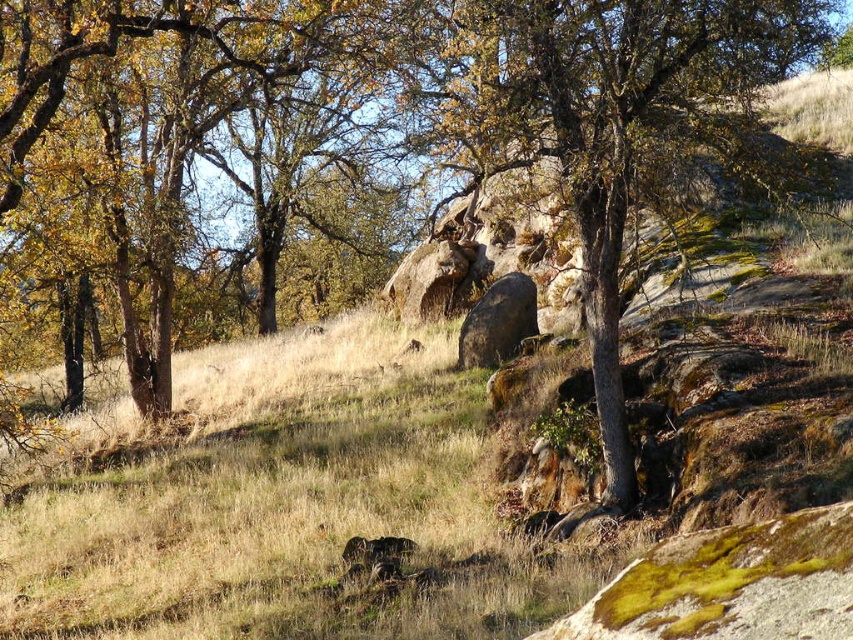
Based on the photo, you are standing at the origin point in the landscape and see two points marked on the terrain. The first point is at coordinates point (654, 49) and the second is at point (473, 307). Which point is closer to you?

Point (654, 49) is in front of point (473, 307), so it is closer to you.

You are standing at the origin point of the landscape. Based on the coordinates given, can you determine the direction of the smooth gray tree at center relative to your position?

The smooth gray tree at center is located at coordinates point (601, 116), which places it to the left and above your current position at the origin.